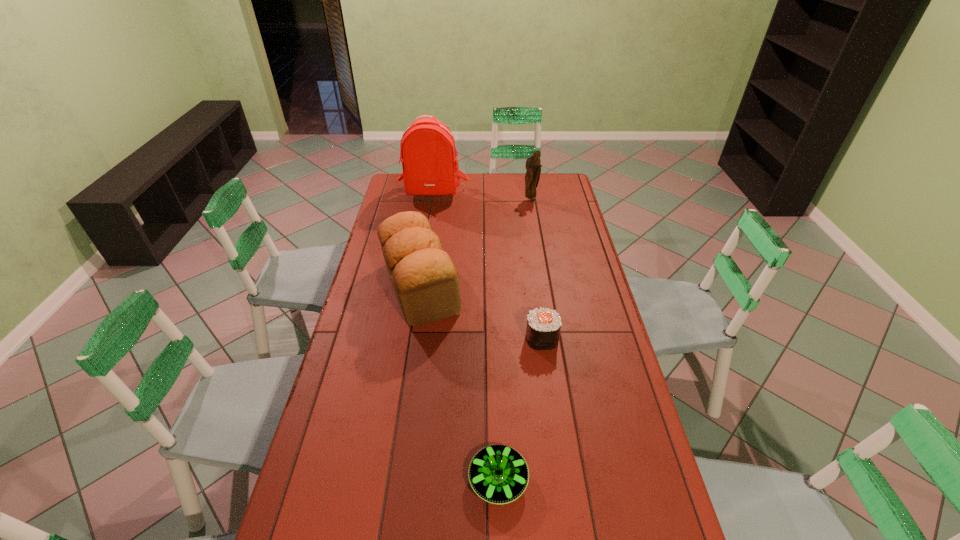
Locate an element on the screen. This screenshot has height=540, width=960. free point between the figurine and the bread is located at coordinates (475, 244).

Locate an element on the screen. vacant point located between the figurine and the sushi is located at coordinates (536, 269).

Find the location of `free space between the figurine and the sushi`. free space between the figurine and the sushi is located at coordinates (536, 269).

Locate an element on the screen. The height and width of the screenshot is (540, 960). free spot between the saucer and the bread is located at coordinates (459, 384).

Find the location of a particular element. This screenshot has height=540, width=960. empty space between the tallest object and the second shortest object is located at coordinates (487, 266).

Identify which object is the second closest to the bread. Please provide its 2D coordinates. Your answer should be formatted as a tuple, i.e. [(x, y)], where the tuple contains the x and y coordinates of a point satisfying the conditions above.

[(428, 150)]

The image size is (960, 540). In order to click on object that can be found as the second closest to the sushi in this screenshot , I will do `click(498, 474)`.

Locate an element on the screen. Image resolution: width=960 pixels, height=540 pixels. vacant area in the image that satisfies the following two spatial constraints: 1. on the main compartment of the third object from left to right; 2. on the right side of the tallest object is located at coordinates point(388,480).

The image size is (960, 540). Identify the location of free spot that satisfies the following two spatial constraints: 1. on the main compartment of the tallest object; 2. on the right side of the nearest object. (388, 480).

Locate an element on the screen. Image resolution: width=960 pixels, height=540 pixels. free spot that satisfies the following two spatial constraints: 1. on the front side of the bread; 2. on the left side of the fourth tallest object is located at coordinates (413, 339).